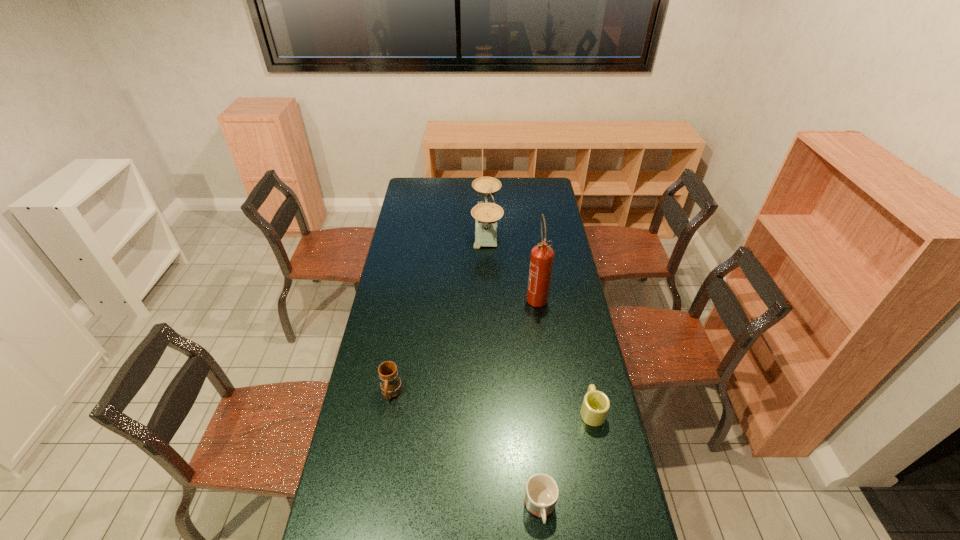
The width and height of the screenshot is (960, 540). In the image, there is a desktop. Find the location of `vacant space at the far edge`. vacant space at the far edge is located at coordinates (460, 188).

At what (x,y) coordinates should I click in order to perform the action: click on vacant area at the left edge. Please return your answer as a coordinate pair (x, y). Looking at the image, I should click on (399, 226).

At what (x,y) coordinates should I click in order to perform the action: click on free space at the right edge of the desktop. Please return your answer as a coordinate pair (x, y). Image resolution: width=960 pixels, height=540 pixels. Looking at the image, I should click on (557, 240).

Where is `vacant space at the far left corner of the desktop`? The width and height of the screenshot is (960, 540). vacant space at the far left corner of the desktop is located at coordinates (409, 178).

Locate an element on the screen. This screenshot has height=540, width=960. free space between the tallest object and the rightmost mug is located at coordinates (564, 354).

In order to click on empty location between the rightmost mug and the nearest mug in this screenshot , I will do [566, 460].

Locate an element on the screen. The image size is (960, 540). vacant area that lies between the rightmost object and the nearest object is located at coordinates (566, 460).

The image size is (960, 540). In order to click on vacant area that lies between the tallest object and the leftmost mug in this screenshot , I will do `click(464, 345)`.

The image size is (960, 540). I want to click on vacant region between the leftmost mug and the fourth object from right to left, so click(439, 310).

At what (x,y) coordinates should I click in order to perform the action: click on free space between the fourth shortest object and the fourth nearest object. Please return your answer as a coordinate pair (x, y). This screenshot has width=960, height=540. Looking at the image, I should click on (512, 262).